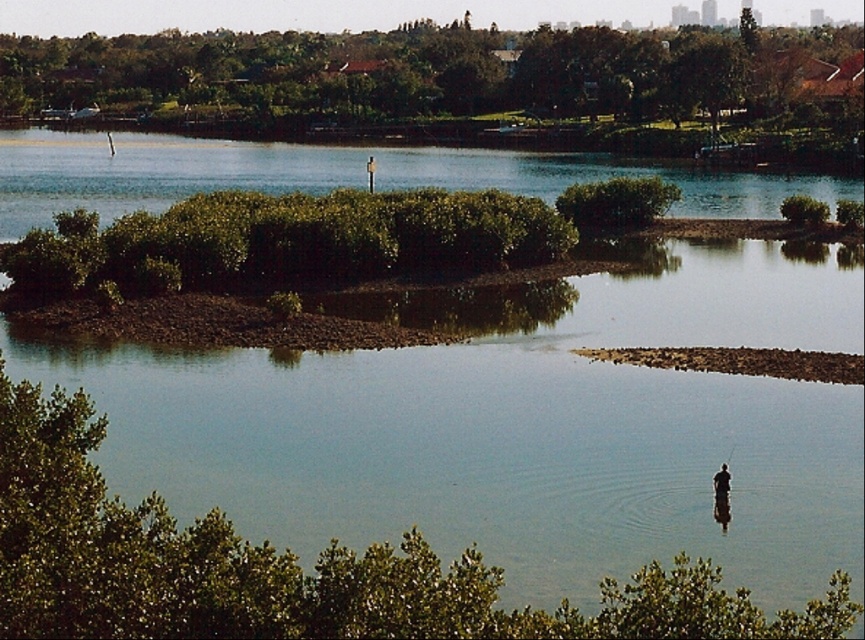
Question: Estimate the real-world distances between objects in this image. Which object is closer to the green leafy tree at upper center?

Choices:
 (A) dark brown wooden pole at center
 (B) green leafy tree at lower center

Answer: (B)

Question: From the image, what is the correct spatial relationship of green leafy tree at lower center in relation to green leafy tree at upper center?

Choices:
 (A) left
 (B) right

Answer: (B)

Question: Is green leafy tree at lower center smaller than green leafy tree at upper center?

Choices:
 (A) no
 (B) yes

Answer: (B)

Question: Which is farther from the green leafy tree at lower center?

Choices:
 (A) green leafy tree at upper center
 (B) dark brown wooden pole at center

Answer: (A)

Question: Is green leafy tree at lower center closer to camera compared to green leafy tree at upper center?

Choices:
 (A) no
 (B) yes

Answer: (B)

Question: Which point appears farthest from the camera in this image?

Choices:
 (A) (69, 524)
 (B) (676, 113)
 (C) (714, 488)

Answer: (B)